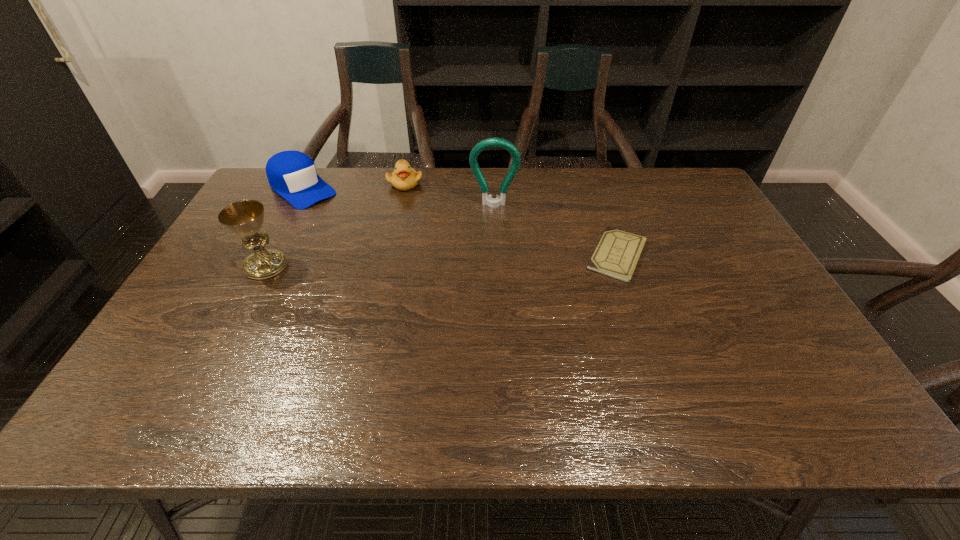
This screenshot has height=540, width=960. Find the location of `vacant region between the fourth object from left to right and the shortest object`. vacant region between the fourth object from left to right and the shortest object is located at coordinates (556, 231).

The image size is (960, 540). I want to click on free space between the chalice and the second object from right to left, so click(380, 235).

This screenshot has height=540, width=960. In order to click on free space between the bottle opener and the shortest object in this screenshot , I will do `click(556, 231)`.

Where is `free space between the checkbook and the third object from right to left`? The height and width of the screenshot is (540, 960). free space between the checkbook and the third object from right to left is located at coordinates (511, 219).

You are a GUI agent. You are given a task and a screenshot of the screen. Output one action in this format:
    pyautogui.click(x=<x>, y=<y>)
    Task: Click on the free space between the second tallest object and the baseball cap
    The width and height of the screenshot is (960, 540).
    Given the screenshot: What is the action you would take?
    pyautogui.click(x=284, y=227)

This screenshot has height=540, width=960. I want to click on free space between the rightmost object and the third object from right to left, so click(x=511, y=219).

Where is `vacant point located between the bottle opener and the baseball cap`? vacant point located between the bottle opener and the baseball cap is located at coordinates click(x=398, y=197).

The width and height of the screenshot is (960, 540). What are the coordinates of `vacant space that is in between the third object from left to right and the rightmost object` in the screenshot? It's located at (511, 219).

At what (x,y) coordinates should I click in order to perform the action: click on free space between the baseball cap and the second shortest object. Please return your answer as a coordinate pair (x, y). Looking at the image, I should click on (353, 186).

The width and height of the screenshot is (960, 540). Identify the location of vacant area between the third tallest object and the chalice. (284, 227).